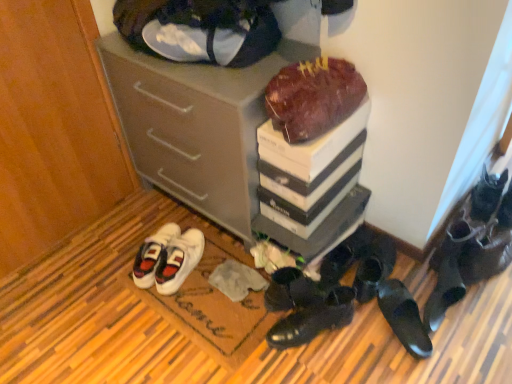
This screenshot has height=384, width=512. I want to click on free space on the front side of black leather shoes at lower center, acting as the second footwear starting from the left, so click(x=316, y=361).